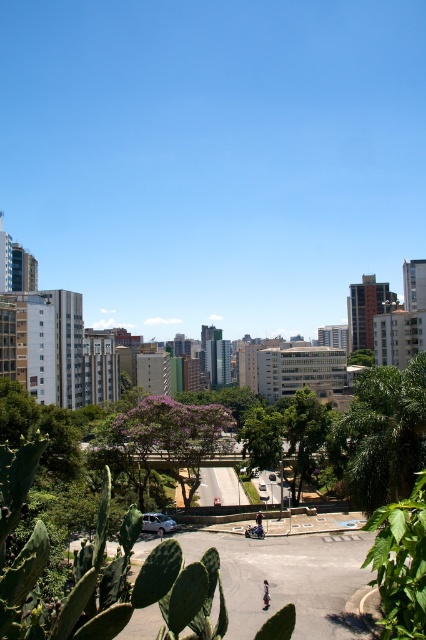
Does green leafy tree at center have a lesser height compared to white matte van at center?

No.

Does green leafy tree at center appear on the right side of white matte van at center?

Indeed, green leafy tree at center is positioned on the right side of white matte van at center.

Describe the element at coordinates (382, 435) in the screenshot. I see `green leafy tree at center` at that location.

Identify the location of green leafy tree at center. (382, 435).

Can you confirm if green leafy tree at center is taller than dark blue jeans at center?

Correct, green leafy tree at center is much taller as dark blue jeans at center.

Consider the image. Who is positioned more to the left, green leafy tree at center or dark blue jeans at center?

dark blue jeans at center is more to the left.

At what (x,y) coordinates should I click in order to perform the action: click on green leafy tree at center. Please return your answer as a coordinate pair (x, y). The image size is (426, 640). Looking at the image, I should click on (382, 435).

At what (x,y) coordinates should I click in order to perform the action: click on green leafy tree at center. Please return your answer as a coordinate pair (x, y). Looking at the image, I should click on (382, 435).

Can you confirm if green leafy tree at center is smaller than light brown leather jacket at center?

No, green leafy tree at center is not smaller than light brown leather jacket at center.

Image resolution: width=426 pixels, height=640 pixels. Describe the element at coordinates (382, 435) in the screenshot. I see `green leafy tree at center` at that location.

Identify the location of green leafy tree at center. (382, 435).

Identify the location of green leafy tree at center. The width and height of the screenshot is (426, 640). (382, 435).